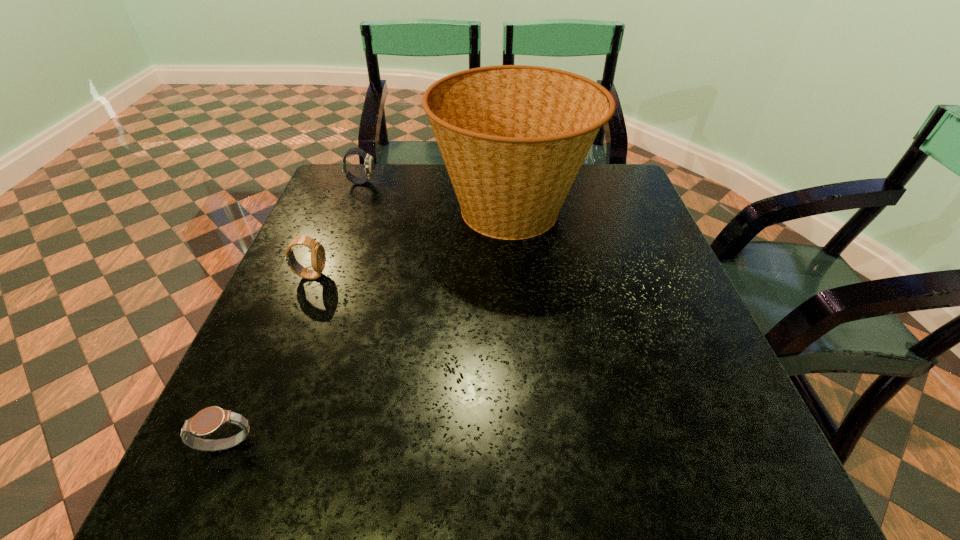
Identify the location of vacant point located between the third farthest object and the farthest watch. The image size is (960, 540). (336, 229).

What are the coordinates of `vacant space in between the basket and the farthest watch` in the screenshot? It's located at [x=437, y=196].

The width and height of the screenshot is (960, 540). In order to click on object that is the third closest to the third farthest object in this screenshot , I will do `click(207, 421)`.

Identify the location of object that is the second closest to the nearest watch. point(513,138).

Identify which watch is the second nearest to the farthest watch. Please provide its 2D coordinates. Your answer should be formatted as a tuple, i.e. [(x, y)], where the tuple contains the x and y coordinates of a point satisfying the conditions above.

[(207, 421)]

Identify which watch is the closest to the second farthest watch. Please provide its 2D coordinates. Your answer should be formatted as a tuple, i.e. [(x, y)], where the tuple contains the x and y coordinates of a point satisfying the conditions above.

[(369, 165)]

The width and height of the screenshot is (960, 540). In order to click on free space that satisfies the following two spatial constraints: 1. on the face of the farthest watch; 2. on the right side of the rightmost object in this screenshot , I will do `click(350, 210)`.

This screenshot has height=540, width=960. What are the coordinates of `vacant space that satisfies the following two spatial constraints: 1. on the face of the farthest watch; 2. on the right side of the rightmost object` in the screenshot? It's located at (350, 210).

The width and height of the screenshot is (960, 540). What are the coordinates of `vacant area that satisfies the following two spatial constraints: 1. on the face of the tallest object; 2. on the right side of the farthest watch` in the screenshot? It's located at (350, 210).

Identify the location of vacant area in the image that satisfies the following two spatial constraints: 1. on the face of the tallest object; 2. on the left side of the farthest watch. (350, 210).